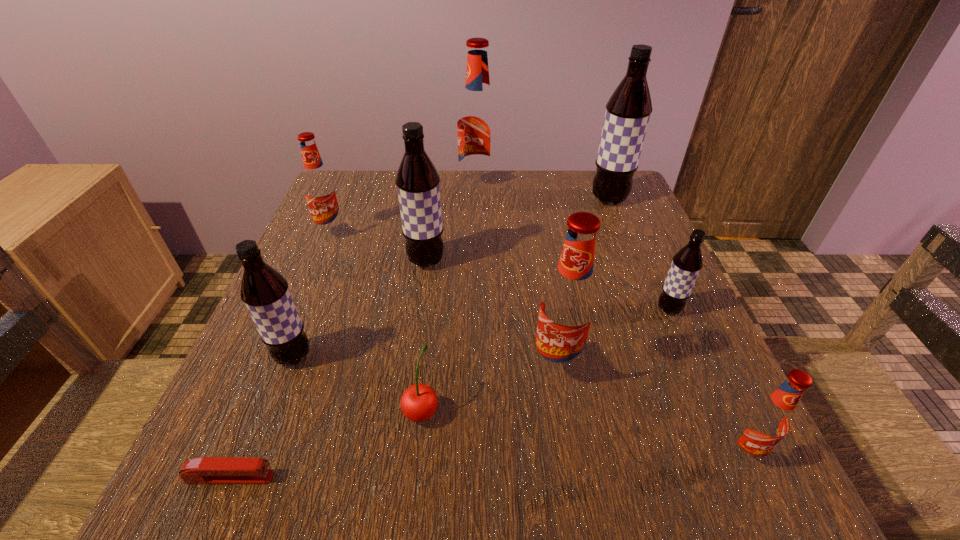
You are a GUI agent. You are given a task and a screenshot of the screen. Output one action in this format:
    pyautogui.click(x=<x>, y=<y>)
    Task: Click on the fifth root beer from right to left
    
    Given the screenshot: What is the action you would take?
    pyautogui.click(x=477, y=125)

At what (x,y) coordinates should I click in order to perform the action: click on the farthest red root beer. Please return your answer as a coordinate pair (x, y). Looking at the image, I should click on (477, 125).

Where is `the biggest brown root beer`? This screenshot has width=960, height=540. the biggest brown root beer is located at coordinates (628, 110).

Where is `the second biggest brown root beer`? The width and height of the screenshot is (960, 540). the second biggest brown root beer is located at coordinates (418, 183).

Locate an element on the screen. Image resolution: width=960 pixels, height=540 pixels. the third brown root beer from right to left is located at coordinates (418, 183).

I want to click on the fifth root beer from left to right, so click(568, 307).

In order to click on the third red root beer from left to right in this screenshot , I will do `click(568, 307)`.

The width and height of the screenshot is (960, 540). I want to click on the eighth nearest object, so coord(320,191).

You are a GUI agent. You are given a task and a screenshot of the screen. Output one action in this format:
    pyautogui.click(x=<x>, y=<y>)
    Task: Click on the leftmost red root beer
    The image size is (960, 540).
    Given the screenshot: What is the action you would take?
    pyautogui.click(x=320, y=191)

Image resolution: width=960 pixels, height=540 pixels. I want to click on the third biggest brown root beer, so click(x=265, y=292).